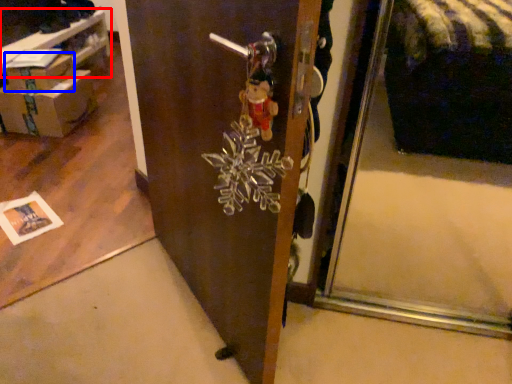
Question: Among these objects, which one is farthest to the camera, table (highlighted by a red box) or cardboard box (highlighted by a blue box)?

Choices:
 (A) table
 (B) cardboard box

Answer: (B)